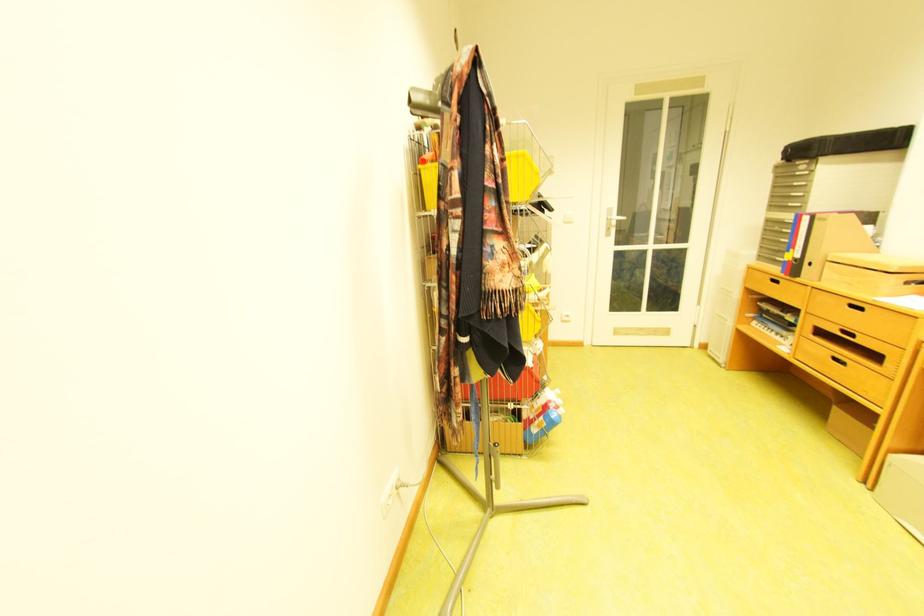
The location [521,176] corresponds to which object?

This point indicates the yellow plastic container.